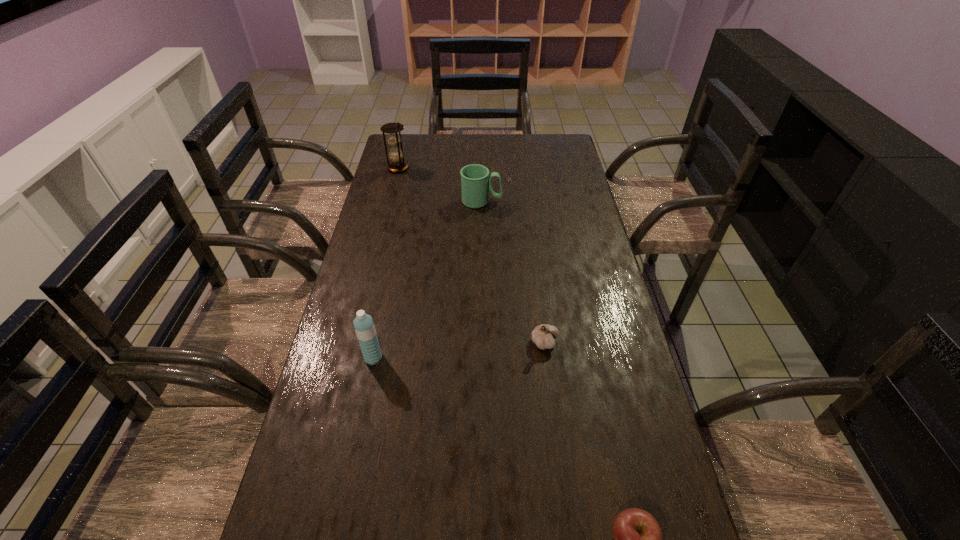
At what (x,y) coordinates should I click in order to perform the action: click on hourglass at the left edge. Please return your answer as a coordinate pair (x, y). Looking at the image, I should click on point(398,164).

This screenshot has height=540, width=960. In order to click on water bottle at the left edge in this screenshot , I will do `click(364, 326)`.

This screenshot has height=540, width=960. In order to click on object at the far left corner in this screenshot , I will do click(x=398, y=164).

In the image, there is a desktop. Where is `free region at the left edge`? This screenshot has height=540, width=960. free region at the left edge is located at coordinates (321, 458).

Where is `free space at the right edge of the desktop`? This screenshot has height=540, width=960. free space at the right edge of the desktop is located at coordinates 583,318.

Locate an element on the screen. vacant region between the third object from right to left and the water bottle is located at coordinates (427, 280).

Find the location of a particular element. The height and width of the screenshot is (540, 960). unoccupied position between the garlic and the third object from left to right is located at coordinates (514, 272).

The height and width of the screenshot is (540, 960). Identify the location of vacant space in between the farthest object and the water bottle. (x=386, y=263).

This screenshot has height=540, width=960. What are the coordinates of `vacant space that is in between the water bottle and the fourth object from left to right` in the screenshot? It's located at (459, 350).

Find the location of a particular element. This screenshot has width=960, height=540. unoccupied position between the hourglass and the garlic is located at coordinates (471, 255).